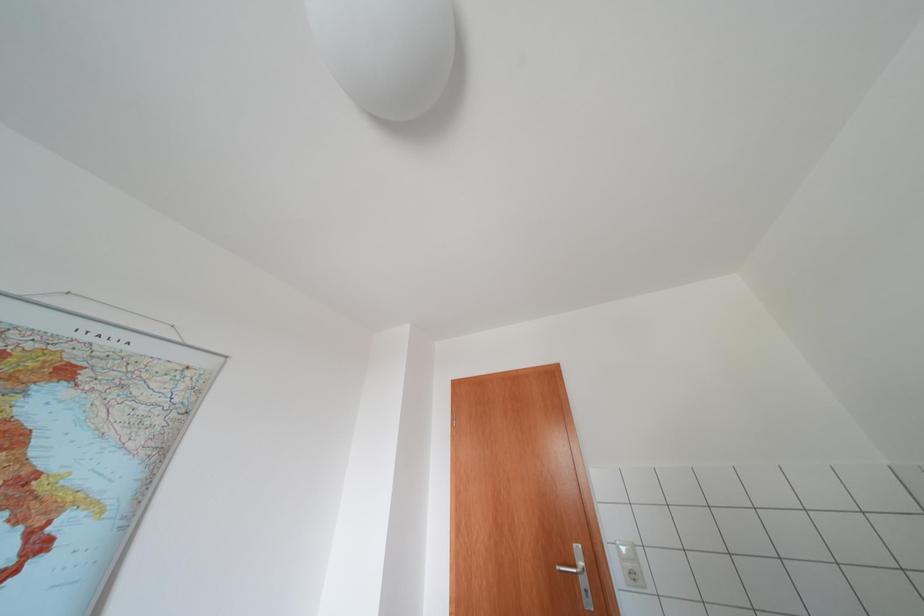
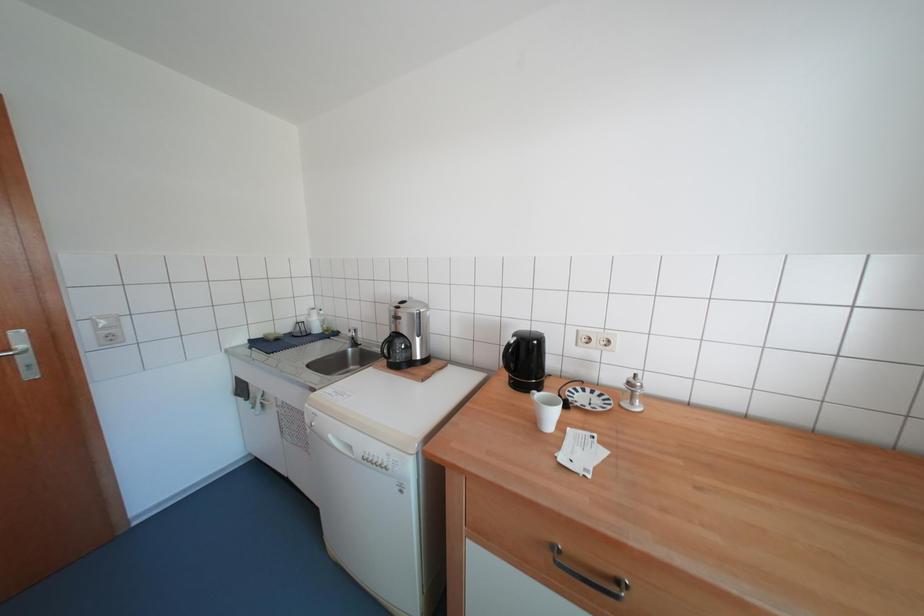
Question: The first image is from the beginning of the video and the second image is from the end. How did the camera likely rotate when shooting the video?

Choices:
 (A) Left
 (B) Right
 (C) Up
 (D) Down

Answer: (B)